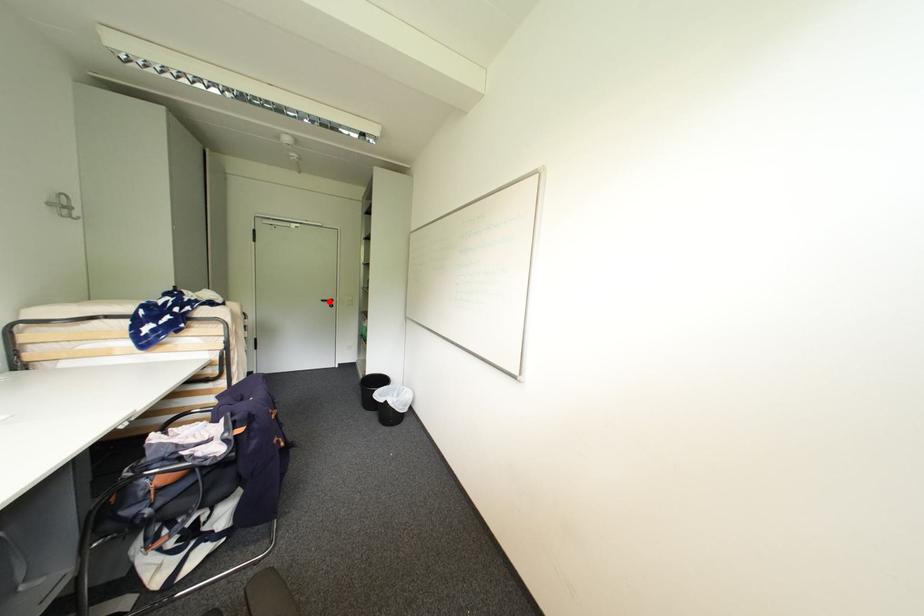
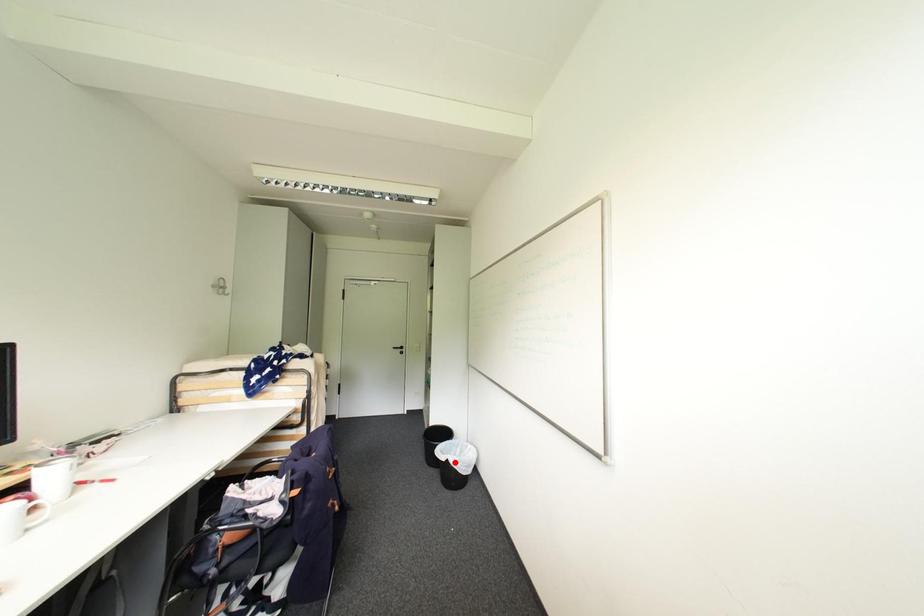
I am providing you with two images of the same scene from different viewpoints. A red point is marked on the first image and another point is marked on the second image. Is the marked point in image1 the same physical position as the marked point in image2?

No